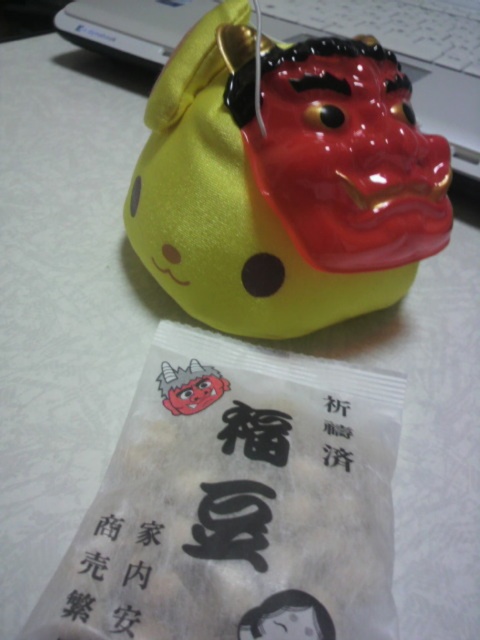
Is point (173, 84) positioned behind point (76, 586)?

Yes.

Is point (338, 125) positioned after point (160, 528)?

That is True.

Find the location of `shiny yellow plush toy at center`. shiny yellow plush toy at center is located at coordinates (284, 180).